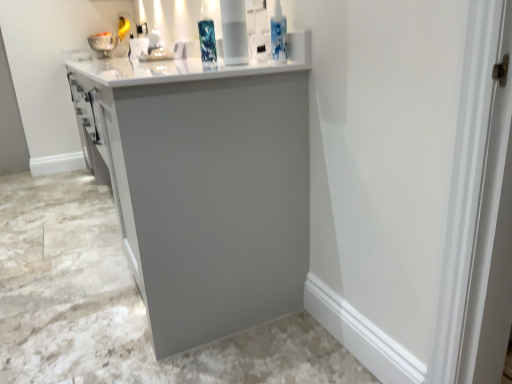
Question: From the image's perspective, would you say matte gray cabinet at center is shown under white glossy vase at upper center?

Choices:
 (A) yes
 (B) no

Answer: (A)

Question: Does matte gray cabinet at center turn towards white glossy vase at upper center?

Choices:
 (A) no
 (B) yes

Answer: (A)

Question: From a real-world perspective, is matte gray cabinet at center under white glossy vase at upper center?

Choices:
 (A) no
 (B) yes

Answer: (B)

Question: Is matte gray cabinet at center facing away from white glossy vase at upper center?

Choices:
 (A) no
 (B) yes

Answer: (A)

Question: From the image's perspective, is matte gray cabinet at center on top of white glossy vase at upper center?

Choices:
 (A) yes
 (B) no

Answer: (B)

Question: Is matte gray cabinet at center taller than white glossy vase at upper center?

Choices:
 (A) no
 (B) yes

Answer: (B)

Question: Is the position of white glossy sink at upper center more distant than that of matte gray cabinet at center?

Choices:
 (A) yes
 (B) no

Answer: (A)

Question: Is white glossy sink at upper center taller than matte gray cabinet at center?

Choices:
 (A) yes
 (B) no

Answer: (B)

Question: Does white glossy sink at upper center appear on the right side of matte gray cabinet at center?

Choices:
 (A) no
 (B) yes

Answer: (B)

Question: From a real-world perspective, is white glossy sink at upper center beneath matte gray cabinet at center?

Choices:
 (A) no
 (B) yes

Answer: (A)

Question: From the image's perspective, is white glossy sink at upper center located beneath matte gray cabinet at center?

Choices:
 (A) yes
 (B) no

Answer: (B)

Question: Are white glossy sink at upper center and matte gray cabinet at center beside each other?

Choices:
 (A) yes
 (B) no

Answer: (B)

Question: Would you say white glossy vase at upper center is outside white glossy sink at upper center?

Choices:
 (A) no
 (B) yes

Answer: (B)